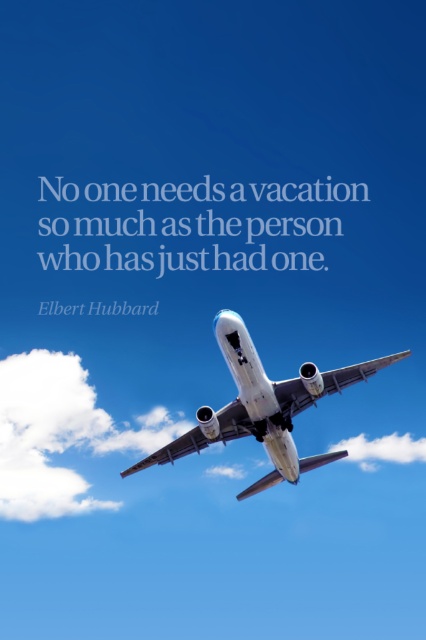
You are a drone operator who needs to fly your drone between the white fluffy cloud at lower left and the white glossy airplane at center. Given that your drone has a maximum flight range of 30 meters, can you safely navigate the drone through this gap?

The distance between the white fluffy cloud at lower left and the white glossy airplane at center is 26.26 meters, which is within the drone operator s maximum flight range of 30 meters. Therefore, the drone can safely navigate through the gap between them.

You are a pilot observing the clouds from the cockpit of the commercial airplane. You notice two clouds, the white fluffy cloud at lower left and the white fluffy cloud at center. Which cloud is directly above the other?

The white fluffy cloud at lower left is positioned over the white fluffy cloud at center, meaning it is directly above it.